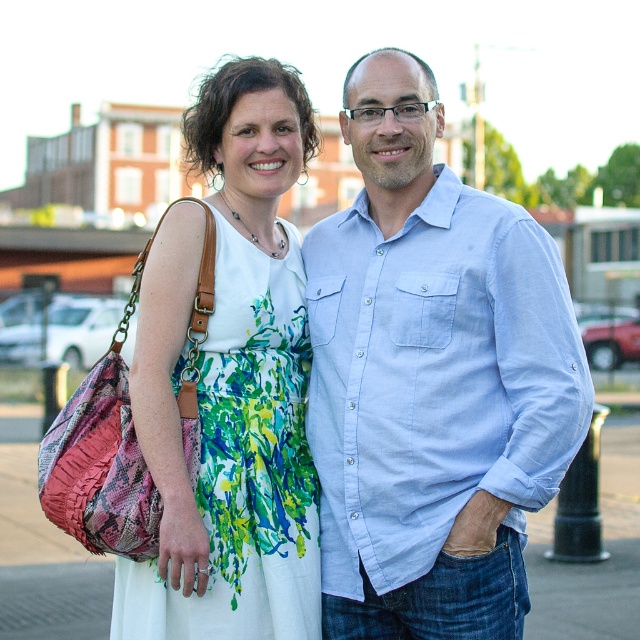
Is light blue denim shirt at center smaller than floral print fabric dress at center?

No, light blue denim shirt at center is not smaller than floral print fabric dress at center.

The height and width of the screenshot is (640, 640). Describe the element at coordinates (432, 378) in the screenshot. I see `light blue denim shirt at center` at that location.

Measure the distance between point (384, 339) and camera.

Point (384, 339) and camera are 11.71 meters apart from each other.

At what (x,y) coordinates should I click in order to perform the action: click on light blue denim shirt at center. Please return your answer as a coordinate pair (x, y). The image size is (640, 640). Looking at the image, I should click on click(x=432, y=378).